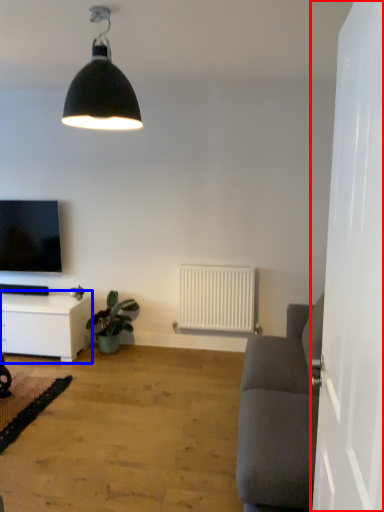
Question: Which of the following is the closest to the observer, side (highlighted by a red box) or table (highlighted by a blue box)?

Choices:
 (A) side
 (B) table

Answer: (A)